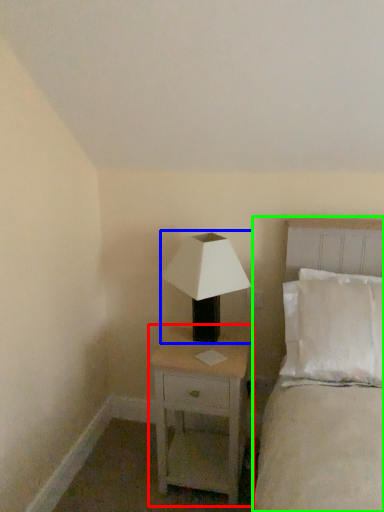
Question: Considering the real-world distances, which object is farthest from nightstand (highlighted by a red box)? lamp (highlighted by a blue box) or bed (highlighted by a green box)?

Choices:
 (A) lamp
 (B) bed

Answer: (B)